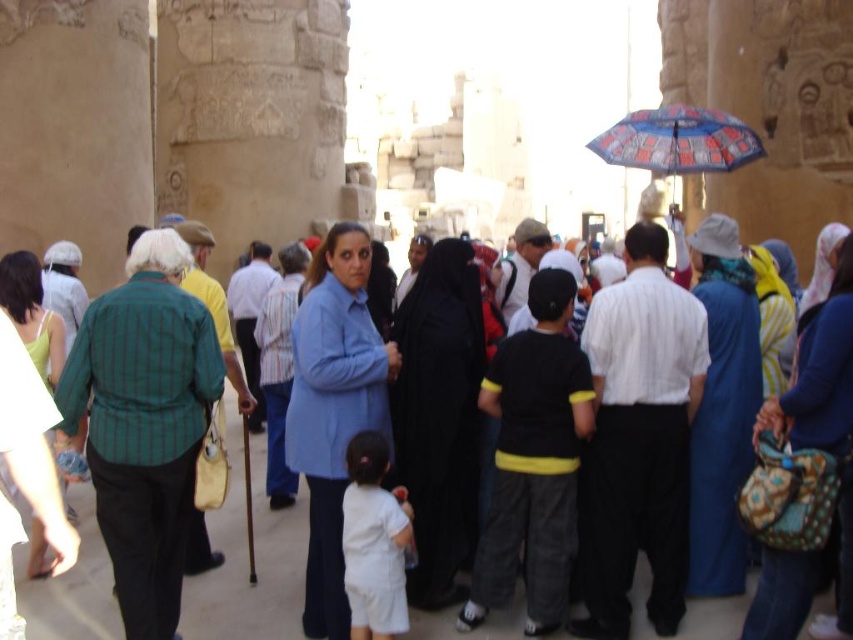
Question: Considering the relative positions of patterned fabric bag at center-right and blue fabric coat at center in the image provided, where is patterned fabric bag at center-right located with respect to blue fabric coat at center?

Choices:
 (A) below
 (B) above

Answer: (A)

Question: Based on their relative distances, which object is farther from the blue fabric dress at center-right?

Choices:
 (A) black matte niqab at center
 (B) patterned fabric bag at center-right

Answer: (A)

Question: Is black cotton shirt at center to the right of black matte niqab at center from the viewer's perspective?

Choices:
 (A) yes
 (B) no

Answer: (A)

Question: Which of these objects is positioned farthest from the blue printed fabric umbrella at upper right?

Choices:
 (A) black cotton shirt at center
 (B) blue fabric dress at center-right
 (C) black matte niqab at center

Answer: (C)

Question: Which point appears farthest from the camera in this image?

Choices:
 (A) (730, 225)
 (B) (701, 112)
 (C) (498, 528)

Answer: (B)

Question: Can you confirm if patterned fabric bag at center-right is positioned to the left of blue printed fabric umbrella at upper right?

Choices:
 (A) yes
 (B) no

Answer: (B)